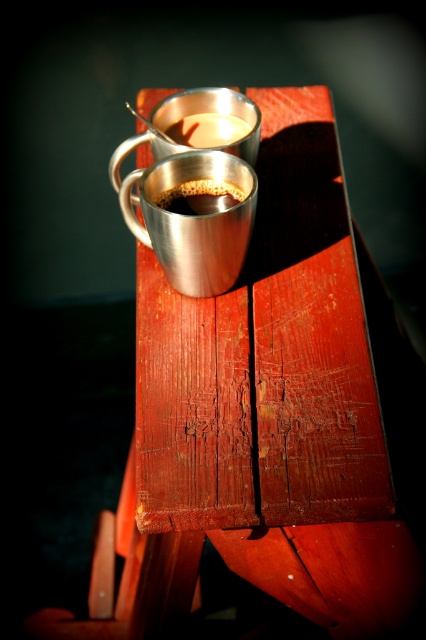
Based on the photo, you are a barista trying to place a new coffee cup on the table between the shiny metallic mug at center and the metallic silver cup at upper center. Based on their positions, which object should you move to make space?

You should move the metallic silver cup at upper center because the shiny metallic mug at center is closer to the viewer, making it harder to access. Moving the metallic silver cup at upper center would create space without disturbing the closer mug.

From the picture: You are a barista preparing two drinks and need to place them on a table. The table has limited space. You have a shiny metallic mug at center and a shiny metallic cup at center. Which one should you place first to ensure both fit properly?

The shiny metallic mug at center should be placed first since it is located below the shiny metallic cup at center, meaning it occupies a lower position and might require more space at the bottom.

You are holding a smartphone camera and want to take a closeup photo of the shiny metallic mug at center. The camera requires the subject to be at least 12 inches away to focus properly. Can you take the photo without moving the mug?

The shiny metallic mug at center is 33.88 inches away from the camera, which is more than the minimum 12 inches required. Therefore, you can take the photo without moving the mug.